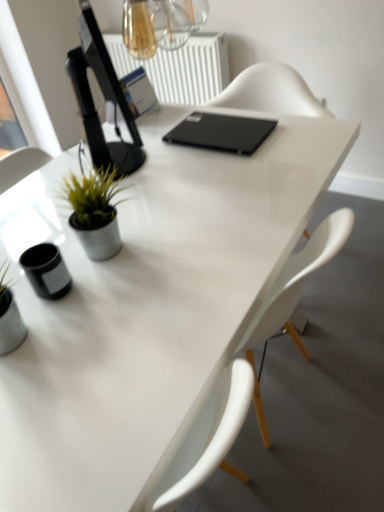
You are a GUI agent. You are given a task and a screenshot of the screen. Output one action in this format:
    pyautogui.click(x=<x>, y=<y>)
    Task: Click on the space that is in front of green matte plant at left
    This screenshot has height=512, width=384.
    Given the screenshot: What is the action you would take?
    pyautogui.click(x=107, y=291)